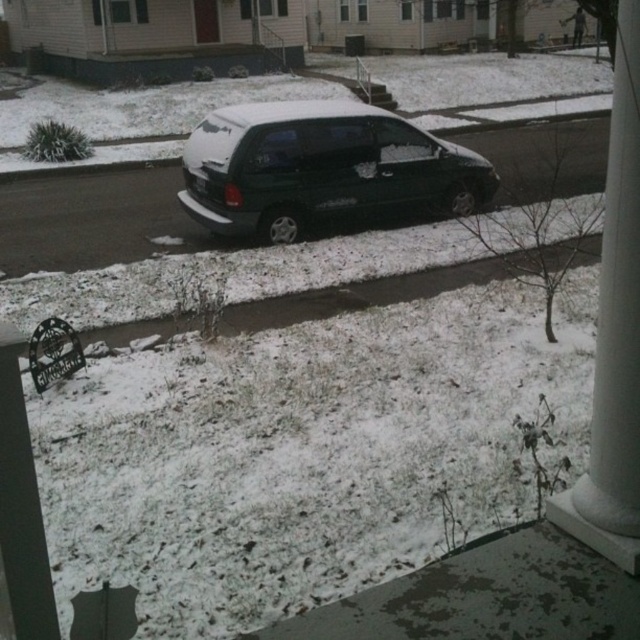
Does shiny dark green minivan at center have a lesser width compared to white smooth column at right?

No, shiny dark green minivan at center is not thinner than white smooth column at right.

Is point (468, 188) behind point (611, 116)?

No.

The width and height of the screenshot is (640, 640). What are the coordinates of `shiny dark green minivan at center` in the screenshot? It's located at (320, 168).